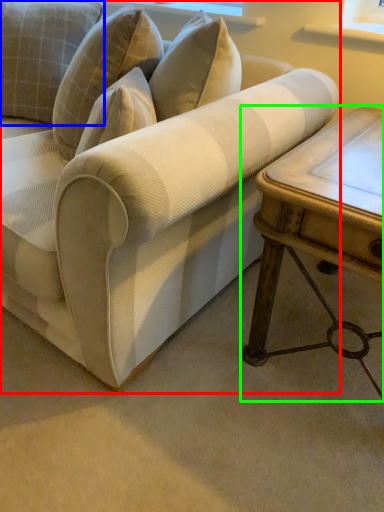
Question: Which object is the closest to the studio couch (highlighted by a red box)? Choose among these: pillow (highlighted by a blue box) or table (highlighted by a green box).

Choices:
 (A) pillow
 (B) table

Answer: (B)